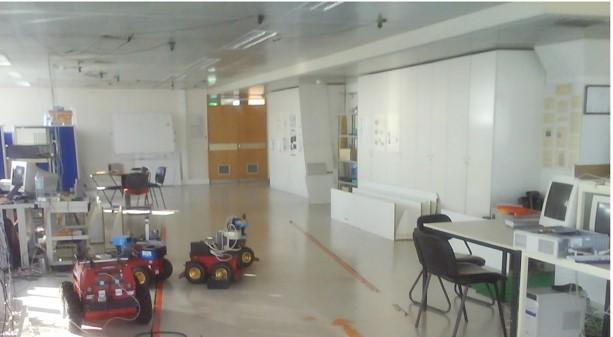
Find the location of a particular element. This screenshot has width=613, height=337. door is located at coordinates (249, 123), (215, 133).